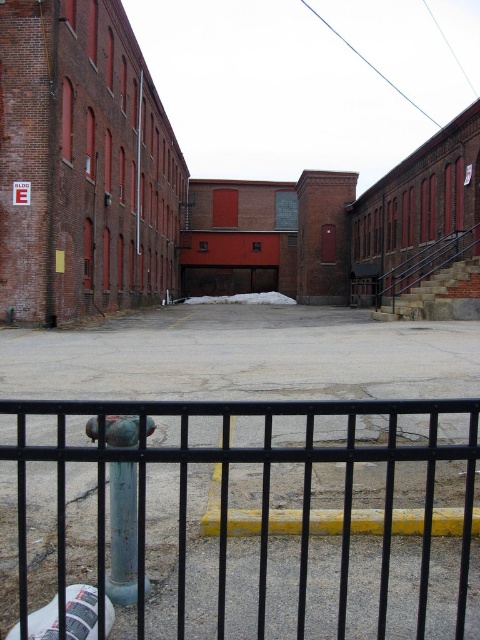
Which is more to the right, black metal fence at lower center or green patina hydrant at center?

black metal fence at lower center is more to the right.

At what (x,y) coordinates should I click in order to perform the action: click on black metal fence at lower center. Please return your answer as a coordinate pair (x, y). Looking at the image, I should click on (232, 516).

What are the coordinates of `black metal fence at lower center` in the screenshot? It's located at (232, 516).